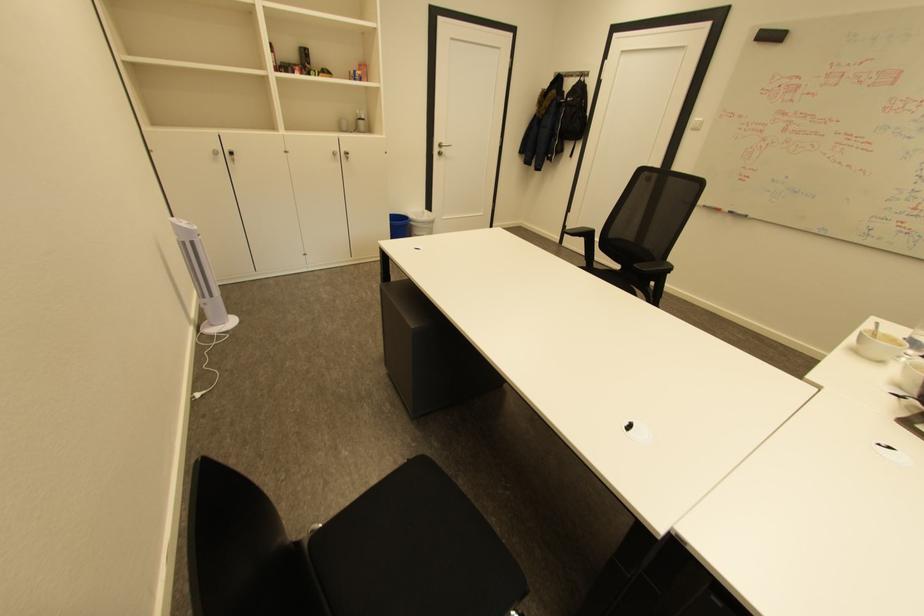
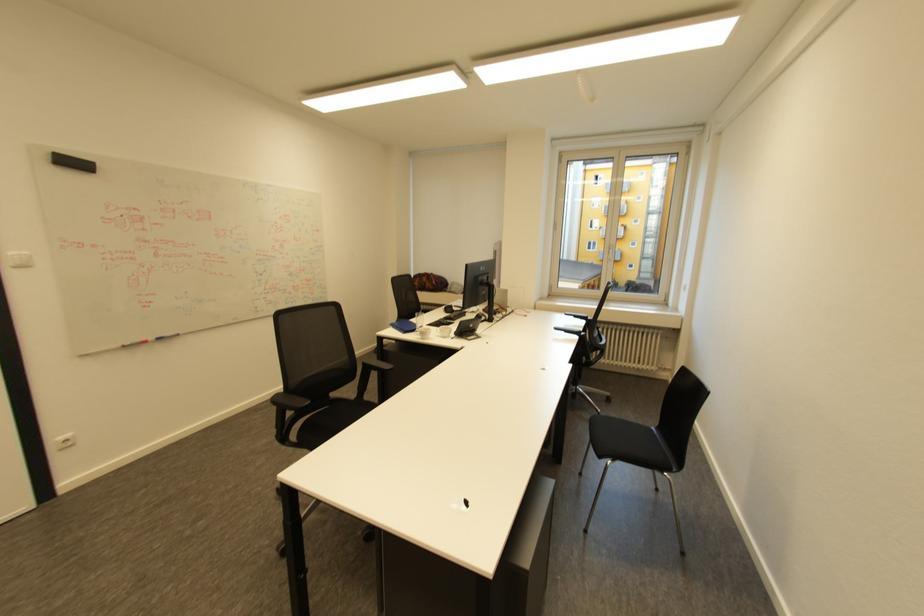
Locate, in the second image, the point that corresponds to [711,206] in the first image.

(128, 346)